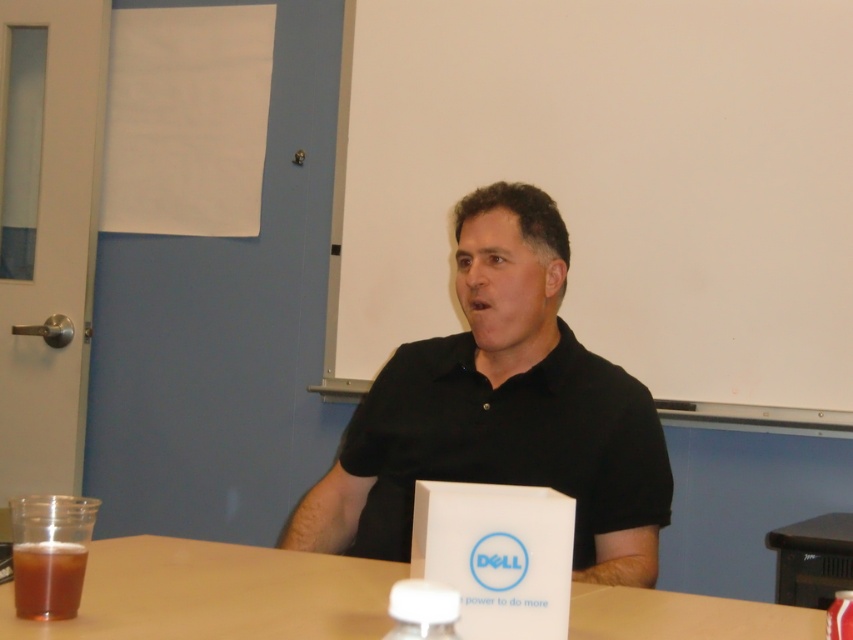
Question: Is the position of brown translucent cup at lower left less distant than that of white plastic bottle at lower center?

Choices:
 (A) no
 (B) yes

Answer: (A)

Question: Which of the following is the farthest from the observer?

Choices:
 (A) smooth wooden table at center
 (B) black matte shirt at center

Answer: (B)

Question: Is white matte board at upper center to the left of white plastic bottle at lower center from the viewer's perspective?

Choices:
 (A) no
 (B) yes

Answer: (A)

Question: Which object is farther from the camera taking this photo?

Choices:
 (A) white plastic bottle at lower center
 (B) white matte board at upper center

Answer: (B)

Question: Which of the following is the farthest from the observer?

Choices:
 (A) (456, 406)
 (B) (82, 554)
 (C) (451, 588)
 (D) (506, 163)

Answer: (D)

Question: Is smooth wooden table at center smaller than brown translucent cup at lower left?

Choices:
 (A) yes
 (B) no

Answer: (B)